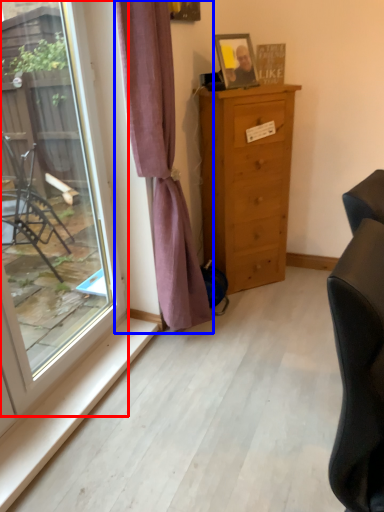
Question: Which object appears farthest to the camera in this image, window (highlighted by a red box) or curtain (highlighted by a blue box)?

Choices:
 (A) window
 (B) curtain

Answer: (B)